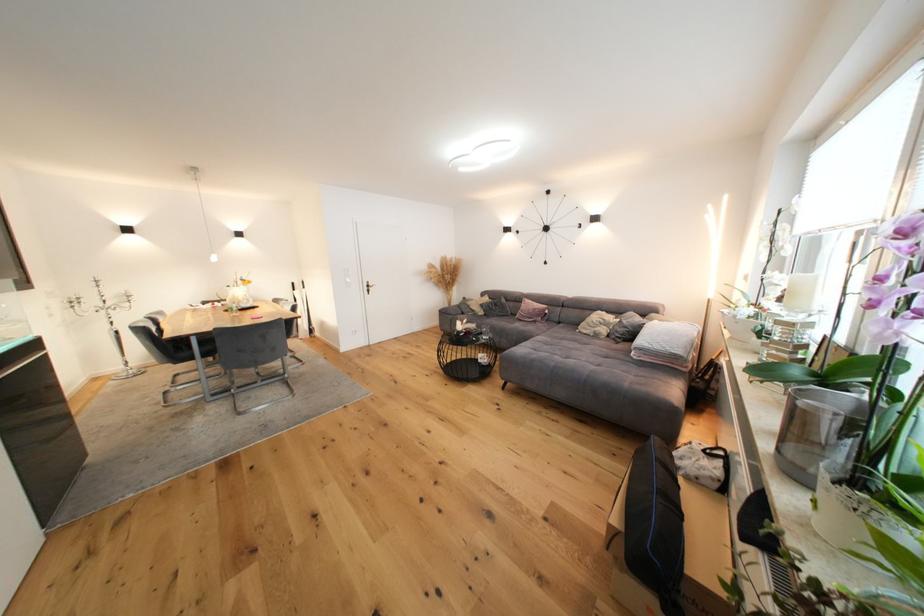
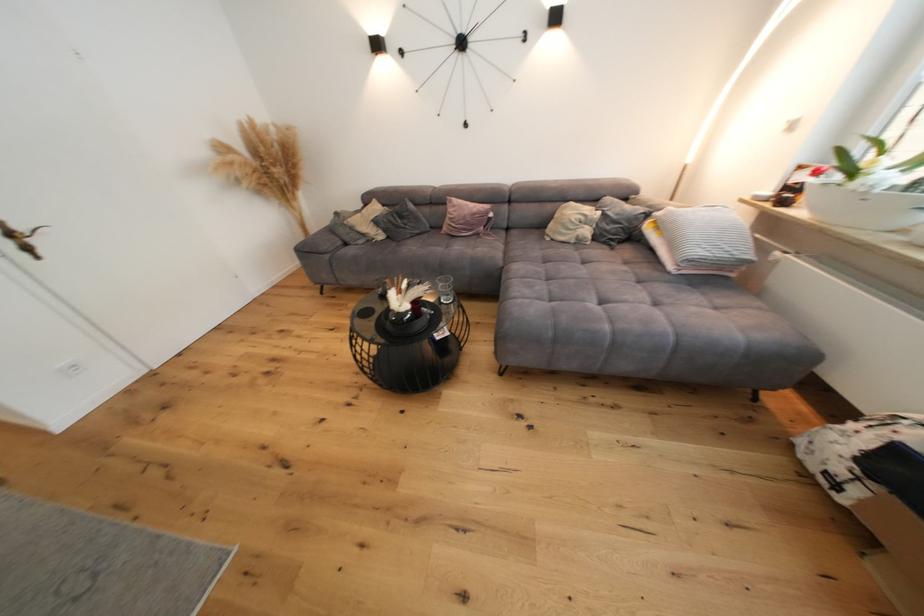
Find the pixel in the second image that matches pixel 503 307 in the first image.

(408, 219)